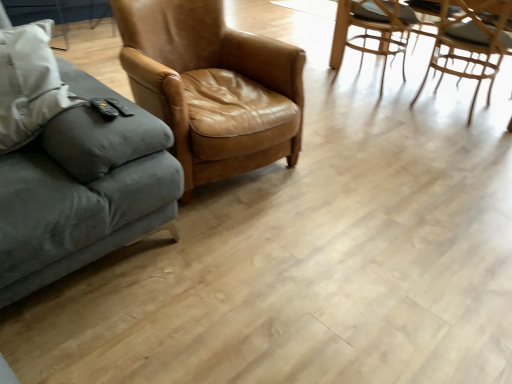
The width and height of the screenshot is (512, 384). I want to click on spots to the right of velvet gray couch at left, so click(259, 263).